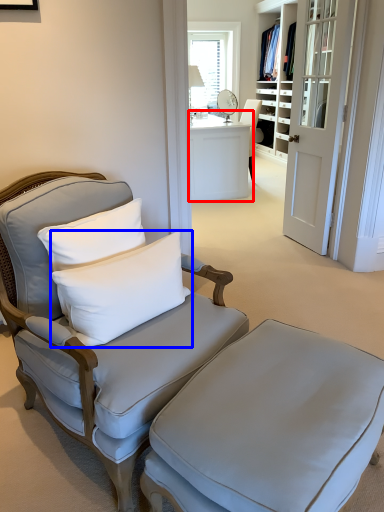
Question: Which object is closer to the camera taking this photo, desk (highlighted by a red box) or pillow (highlighted by a blue box)?

Choices:
 (A) desk
 (B) pillow

Answer: (B)